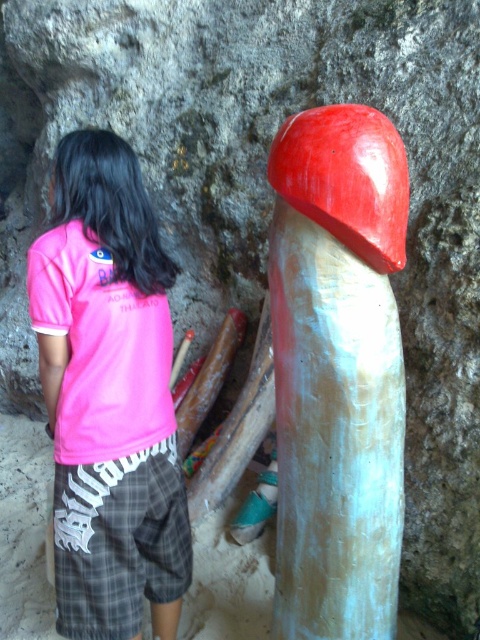
Question: Which object appears farthest from the camera in this image?

Choices:
 (A) smooth white mushroom at center
 (B) pink cotton shirt at center

Answer: (B)

Question: Can you confirm if smooth white mushroom at center is smaller than pink cotton shirt at center?

Choices:
 (A) no
 (B) yes

Answer: (A)

Question: Which point appears farthest from the camera in this image?

Choices:
 (A) (78, 628)
 (B) (394, 458)

Answer: (A)

Question: Is smooth white mushroom at center positioned at the back of pink cotton shirt at center?

Choices:
 (A) yes
 (B) no

Answer: (B)

Question: Is smooth white mushroom at center positioned in front of pink cotton shirt at center?

Choices:
 (A) yes
 (B) no

Answer: (A)

Question: Among these objects, which one is nearest to the camera?

Choices:
 (A) smooth white mushroom at center
 (B) pink cotton shirt at center

Answer: (A)